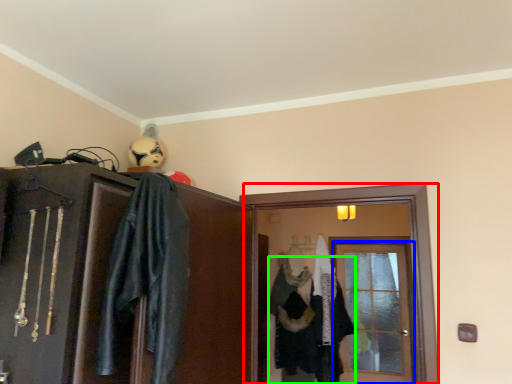
Question: Which object is positioned farthest from screen door (highlighted by a red box)? Select from door (highlighted by a blue box) and clothing (highlighted by a green box).

Choices:
 (A) door
 (B) clothing

Answer: (B)